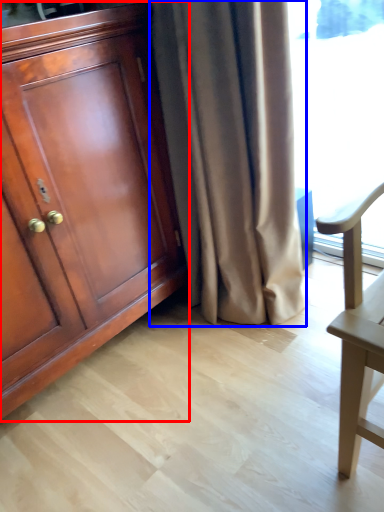
Question: Among these objects, which one is farthest to the camera, cabinetry (highlighted by a red box) or curtain (highlighted by a blue box)?

Choices:
 (A) cabinetry
 (B) curtain

Answer: (B)